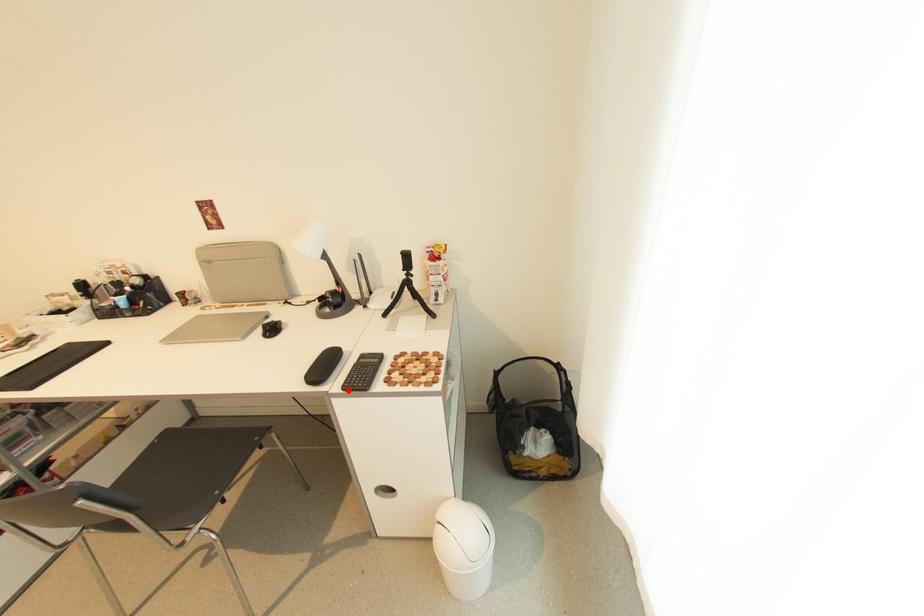
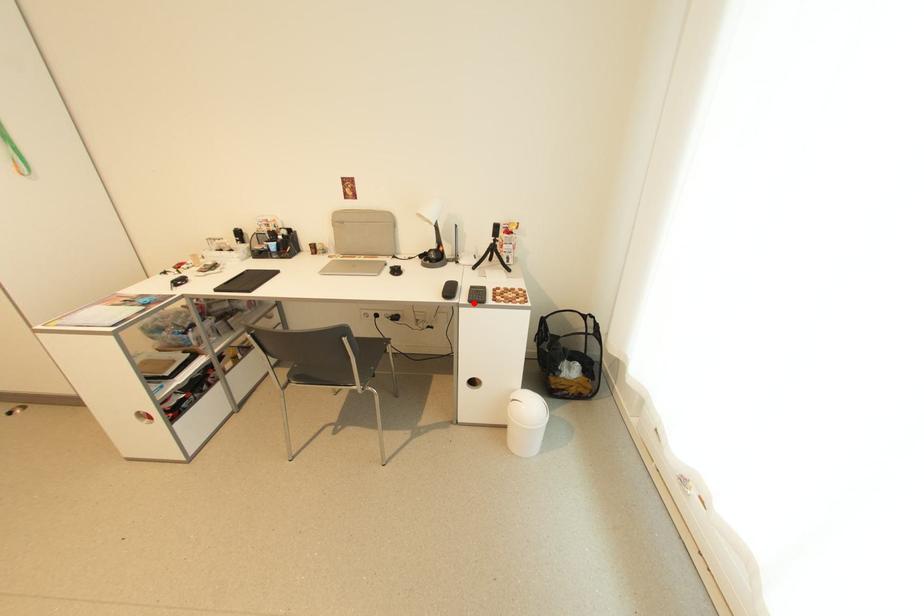
I am providing you with two images of the same scene from different viewpoints. A red point is marked on the first image and another point is marked on the second image. Does the point marked in image1 correspond to the same location as the one in image2?

Yes